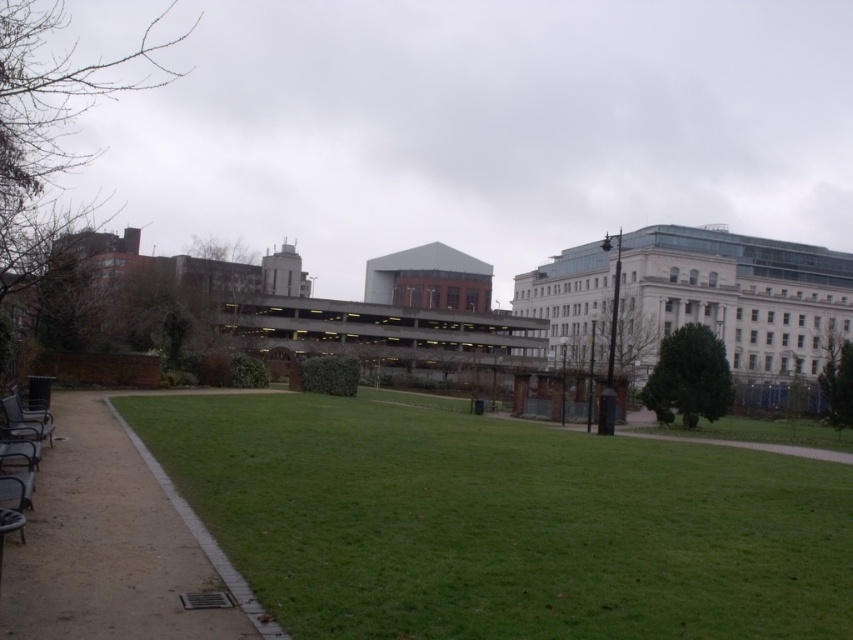
Does point (167, 470) come farther from viewer compared to point (93, 500)?

Yes, it is.

Does green grass at center have a lesser width compared to brown gravel path at lower left?

Incorrect, green grass at center's width is not less than brown gravel path at lower left's.

Is point (683, 458) less distant than point (56, 550)?

That is False.

The width and height of the screenshot is (853, 640). I want to click on green grass at center, so point(503,524).

Between brown gravel path at lower left and metallic silver bench at lower left, which one is positioned higher?

metallic silver bench at lower left is higher up.

Who is lower down, brown gravel path at lower left or metallic silver bench at lower left?

brown gravel path at lower left

What are the coordinates of `brown gravel path at lower left` in the screenshot? It's located at (113, 545).

Is green grass at center thinner than metallic silver bench at lower left?

In fact, green grass at center might be wider than metallic silver bench at lower left.

Can you confirm if green grass at center is shorter than metallic silver bench at lower left?

No.

Where is `green grass at center`? The height and width of the screenshot is (640, 853). green grass at center is located at coordinates (503, 524).

At what (x,y) coordinates should I click in order to perform the action: click on green grass at center. Please return your answer as a coordinate pair (x, y). The image size is (853, 640). Looking at the image, I should click on (503, 524).